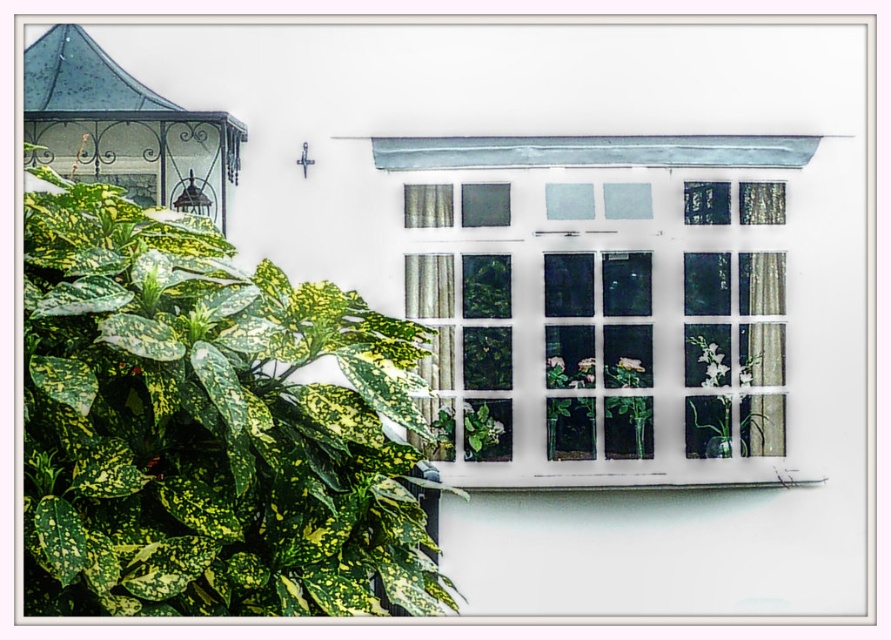
Question: Among these points, which one is nearest to the camera?

Choices:
 (A) (717, 483)
 (B) (749, 332)
 (C) (209, 554)
 (D) (620, 380)

Answer: (C)

Question: Which object appears closest to the camera in this image?

Choices:
 (A) green variegated leaf at left
 (B) green glossy plant at center
 (C) white painted wood at lower center

Answer: (A)

Question: Which of the following is the farthest from the observer?

Choices:
 (A) white painted wood at lower center
 (B) green variegated leaf at left

Answer: (A)

Question: Is green variegated leaf at left above white painted wood window frame at center?

Choices:
 (A) yes
 (B) no

Answer: (B)

Question: Does translucent glass vase at center-right appear on the left side of white painted wood at lower center?

Choices:
 (A) no
 (B) yes

Answer: (A)

Question: Does green variegated leaf at left appear on the left side of white painted wood window frame at center?

Choices:
 (A) no
 (B) yes

Answer: (B)